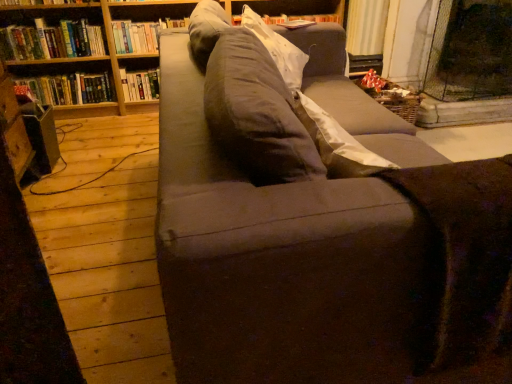
Question: Could you tell me if hardcover book at upper left, which appears as the 2th book when viewed from the left, is facing hardcover book at upper left, which is the second book in right-to-left order?

Choices:
 (A) yes
 (B) no

Answer: (B)

Question: Is hardcover book at upper left, which appears as the 2th book when viewed from the left, not near hardcover book at upper left, the third book in the left-to-right sequence?

Choices:
 (A) no
 (B) yes

Answer: (A)

Question: Considering the relative sizes of hardcover book at upper left, which appears as the 2th book when viewed from the left, and hardcover book at upper left, which is the second book in right-to-left order, in the image provided, is hardcover book at upper left, which appears as the 2th book when viewed from the left, thinner than hardcover book at upper left, which is the second book in right-to-left order,?

Choices:
 (A) yes
 (B) no

Answer: (B)

Question: Considering the relative sizes of hardcover book at upper left, the third book viewed from the right, and hardcover book at upper left, the third book in the left-to-right sequence, in the image provided, is hardcover book at upper left, the third book viewed from the right, taller than hardcover book at upper left, the third book in the left-to-right sequence,?

Choices:
 (A) no
 (B) yes

Answer: (B)

Question: Is hardcover book at upper left, the third book in the left-to-right sequence, at the back of hardcover book at upper left, the third book viewed from the right?

Choices:
 (A) no
 (B) yes

Answer: (A)

Question: Based on their sizes in the image, would you say wooden bookcase at upper left is bigger or smaller than hardcover book at upper left, which is the fourth book from left to right?

Choices:
 (A) small
 (B) big

Answer: (B)

Question: Do you think wooden bookcase at upper left is within hardcover book at upper left, which is the 1th book in right-to-left order, or outside of it?

Choices:
 (A) inside
 (B) outside

Answer: (B)

Question: Based on their positions, is wooden bookcase at upper left located to the left or right of hardcover book at upper left, which is the 1th book in right-to-left order?

Choices:
 (A) left
 (B) right

Answer: (B)

Question: From the image's perspective, is wooden bookcase at upper left above or below hardcover book at upper left, which is the 1th book in right-to-left order?

Choices:
 (A) above
 (B) below

Answer: (B)

Question: Would you say hardcover book at upper left, which is the second book in right-to-left order, is to the left or to the right of wooden bookcase at upper left in the picture?

Choices:
 (A) left
 (B) right

Answer: (A)

Question: Is point (154, 82) positioned closer to the camera than point (10, 29)?

Choices:
 (A) farther
 (B) closer

Answer: (A)

Question: Would you say hardcover book at upper left, which is the second book in right-to-left order, is inside or outside wooden bookcase at upper left?

Choices:
 (A) inside
 (B) outside

Answer: (A)

Question: Relative to wooden bookcase at upper left, is hardcover book at upper left, the third book in the left-to-right sequence, in front or behind?

Choices:
 (A) front
 (B) behind

Answer: (B)

Question: Considering the positions of hardcover book at upper left, the third book viewed from the right, and hardcover book at upper left, the third book in the left-to-right sequence, in the image, is hardcover book at upper left, the third book viewed from the right, bigger or smaller than hardcover book at upper left, the third book in the left-to-right sequence,?

Choices:
 (A) small
 (B) big

Answer: (B)

Question: Looking at their shapes, would you say hardcover book at upper left, the third book viewed from the right, is wider or thinner than hardcover book at upper left, the third book in the left-to-right sequence?

Choices:
 (A) wide
 (B) thin

Answer: (A)